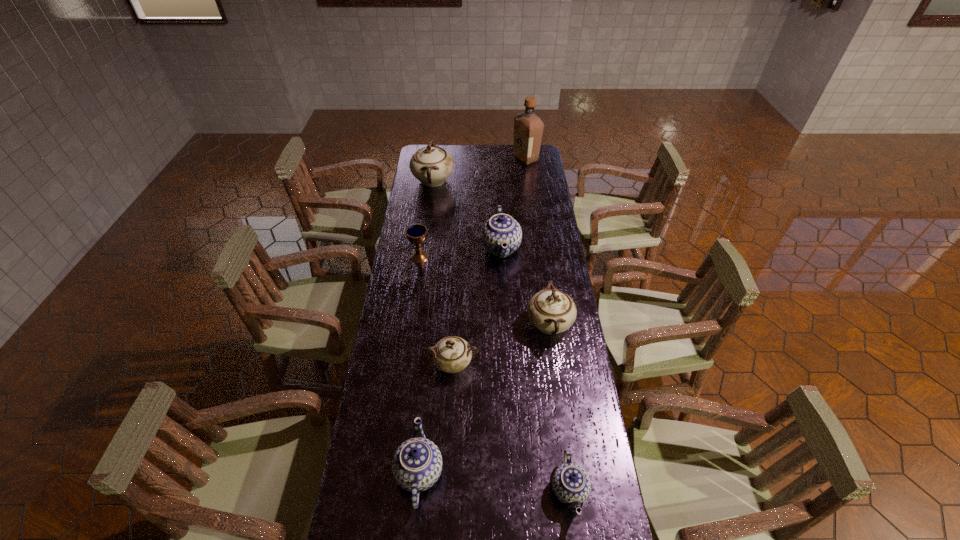
Find the location of `object situated at the far left corner`. object situated at the far left corner is located at coordinates (431, 165).

The image size is (960, 540). Find the location of `object positioned at the far right corner`. object positioned at the far right corner is located at coordinates (528, 128).

This screenshot has width=960, height=540. In order to click on free space at the far edge of the desktop in this screenshot , I will do `click(450, 146)`.

Locate an element on the screen. free spot at the left edge of the desktop is located at coordinates (408, 204).

This screenshot has width=960, height=540. Find the location of `free region at the right edge of the desktop`. free region at the right edge of the desktop is located at coordinates (605, 500).

This screenshot has height=540, width=960. I want to click on free point between the smallest white chinaware and the chalice, so click(436, 310).

Identify the location of vacant area that lies between the second biggest white chinaware and the rightmost blue chinaware. This screenshot has width=960, height=540. (559, 407).

You are a GUI agent. You are given a task and a screenshot of the screen. Output one action in this format:
    pyautogui.click(x=<x>, y=<y>)
    Task: Click on the empty location between the second blue chinaware from right to left and the chalice
    This screenshot has width=960, height=540.
    Given the screenshot: What is the action you would take?
    pyautogui.click(x=461, y=252)

Locate an element on the screen. The width and height of the screenshot is (960, 540). empty location between the rightmost white chinaware and the brown liquor is located at coordinates (538, 241).

Find the location of `free point between the smallest white chinaware and the blue chalice`. free point between the smallest white chinaware and the blue chalice is located at coordinates (436, 310).